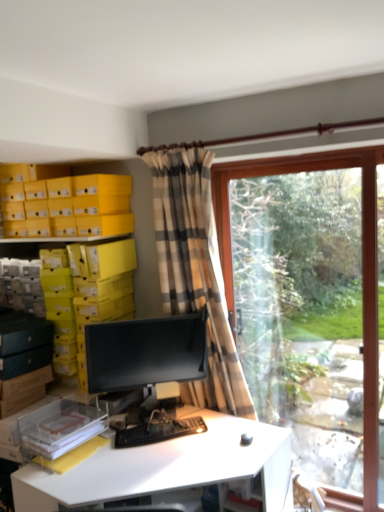
Question: Looking at the image, does black matte keyboard at center seem bigger or smaller compared to yellow cardboard boxes at upper left?

Choices:
 (A) big
 (B) small

Answer: (B)

Question: Is black matte keyboard at center in front of or behind yellow cardboard boxes at upper left in the image?

Choices:
 (A) front
 (B) behind

Answer: (A)

Question: Which object is the farthest from the black matte keyboard at center?

Choices:
 (A) yellow cardboard boxes at upper left
 (B) plaid fabric curtain at center
 (C) white glossy desk at center
 (D) matte black monitor at center
 (E) clear glass window at right

Answer: (A)

Question: Which object is the farthest from the clear glass window at right?

Choices:
 (A) white glossy desk at center
 (B) yellow cardboard boxes at upper left
 (C) matte black monitor at center
 (D) plaid fabric curtain at center
 (E) black matte keyboard at center

Answer: (B)